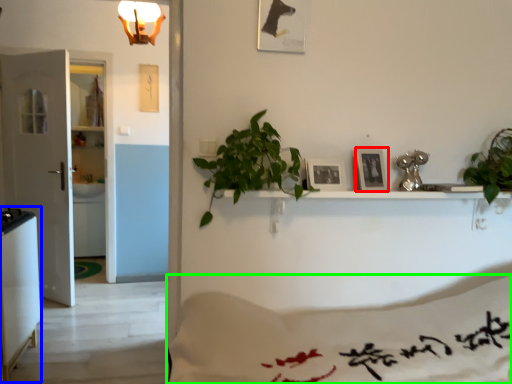
Question: Which object is positioned closest to picture frame (highlighted by a red box)? Select from appliance (highlighted by a blue box) and sheet (highlighted by a green box).

Choices:
 (A) appliance
 (B) sheet

Answer: (B)